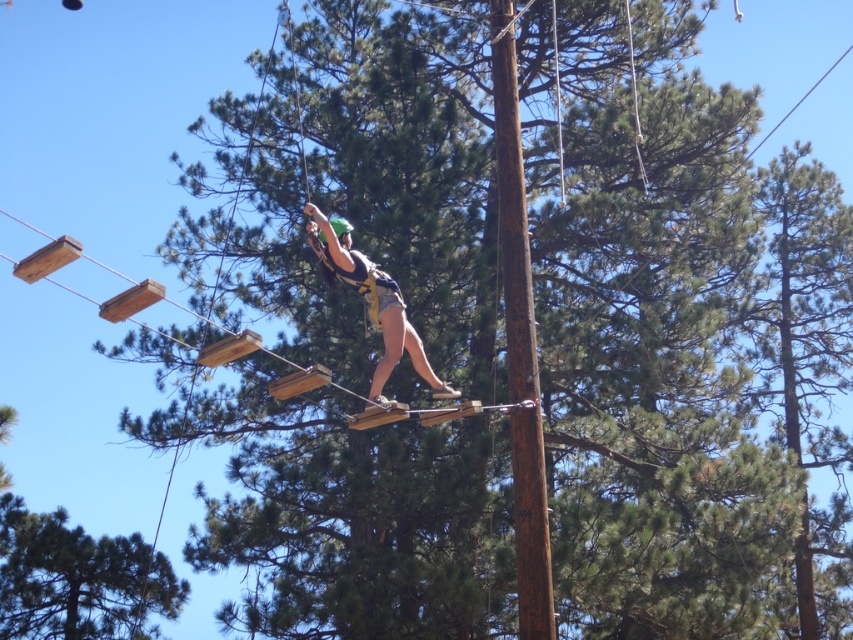
You are a drone operator trying to capture a photo of the brown wood telegraph pole at center. The drone is currently at the point with coordinates of 0.3,0.3. What direction should you move the drone to reach the pole?

The brown wood telegraph pole at center is located at coordinates (520, 340). Since the drone is at (254, 192), you should move the drone northeast to reach the pole.

You are standing at the camera position and want to take a photo of the green pine tree at lower left. If your camera has a maximum focus range of 60 feet, will you be able to focus on the tree?

The green pine tree at lower left is 65.83 feet from the camera, which exceeds the maximum focus range of 60 feet. Therefore, the camera cannot focus on the tree.